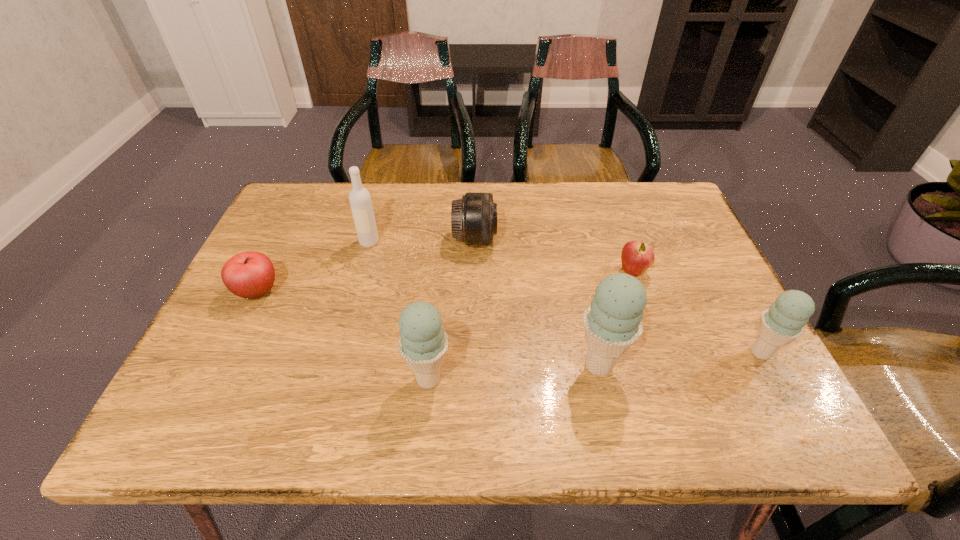
Given the evenly spaced ice creams in the image, where should an extra ice cream be added on the left to preserve the spacing? Please point to a vacant space. Please provide its 2D coordinates. Your answer should be formatted as a tuple, i.e. [(x, y)], where the tuple contains the x and y coordinates of a point satisfying the conditions above.

[(250, 393)]